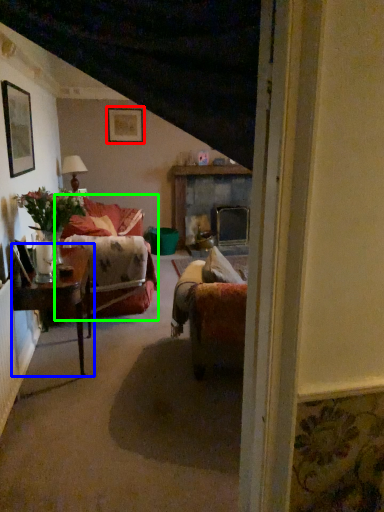
Question: Which is farther away from picture frame (highlighted by a red box)? table (highlighted by a blue box) or couch (highlighted by a green box)?

Choices:
 (A) table
 (B) couch

Answer: (A)